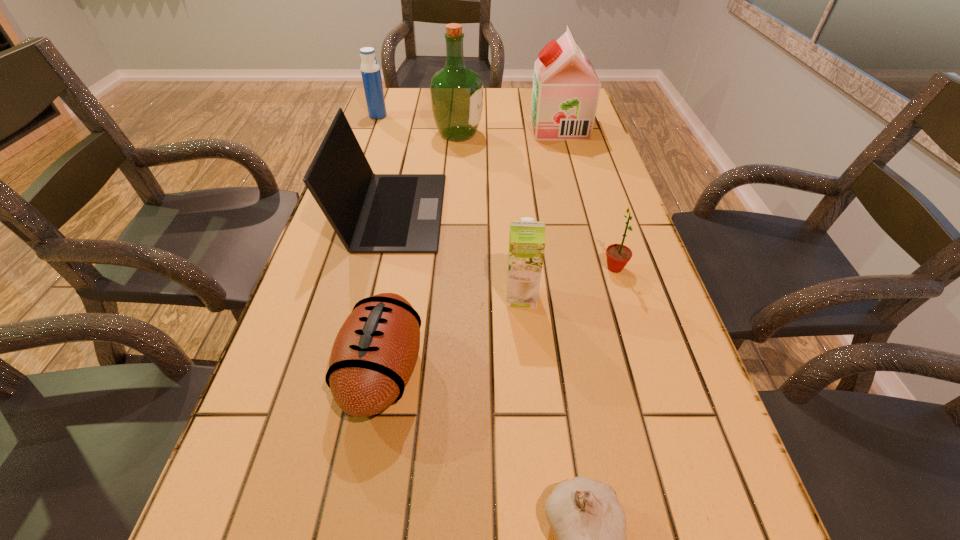
In the image, there is a desktop. Identify the location of vacant space at the far edge. This screenshot has height=540, width=960. (497, 98).

This screenshot has height=540, width=960. What are the coordinates of `vacant space at the left edge` in the screenshot? It's located at (347, 261).

Locate an element on the screen. vacant point at the right edge is located at coordinates (584, 168).

This screenshot has width=960, height=540. What are the coordinates of `free space between the water bottle and the liquor` in the screenshot? It's located at (x=419, y=125).

Locate an element on the screen. The width and height of the screenshot is (960, 540). free spot between the farther soya milk and the fourth farthest object is located at coordinates (475, 169).

Identify which object is located as the third nearest to the fifth nearest object. Please provide its 2D coordinates. Your answer should be formatted as a tuple, i.e. [(x, y)], where the tuple contains the x and y coordinates of a point satisfying the conditions above.

[(374, 354)]

Choose which object is the fifth nearest neighbor to the laptop. Please provide its 2D coordinates. Your answer should be formatted as a tuple, i.e. [(x, y)], where the tuple contains the x and y coordinates of a point satisfying the conditions above.

[(370, 70)]

Locate an element on the screen. The width and height of the screenshot is (960, 540). free space that satisfies the following two spatial constraints: 1. on the back side of the third nearest object; 2. on the right side of the football (American) is located at coordinates (396, 296).

Identify the location of free space that satisfies the following two spatial constraints: 1. on the back side of the nearer soya milk; 2. on the screen of the laptop. (514, 211).